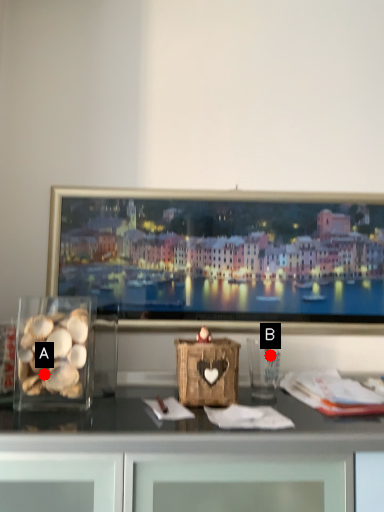
Question: Two points are circled on the image, labeled by A and B beside each circle. Which point is farther to the camera?

Choices:
 (A) A is further
 (B) B is further

Answer: (B)